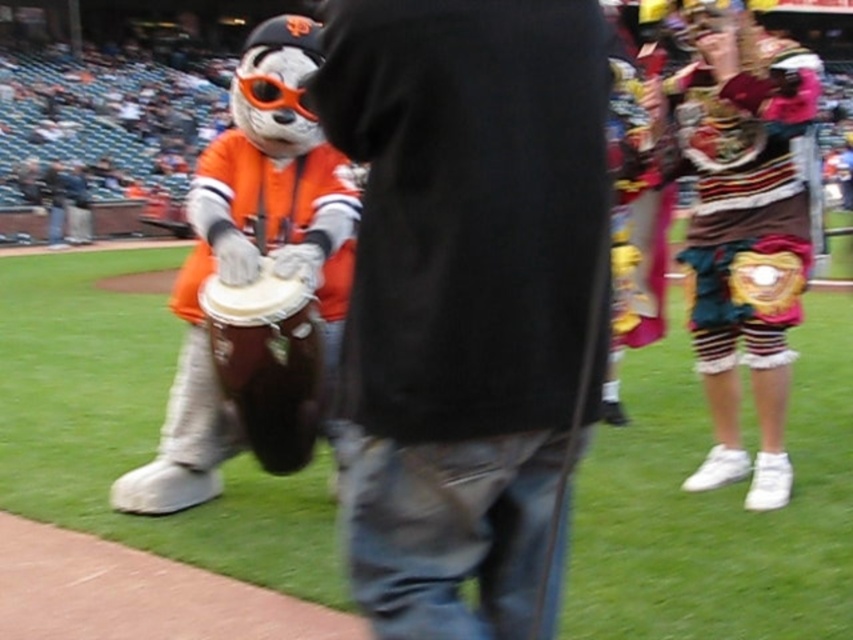
You are a photographer positioned at the front of the baseball stadium. You need to capture a photo of both the black cotton shirt at center and the orange fabric mascot at left. Based on their positions, which object should you adjust your camera focus on first to ensure both are in frame?

The orange fabric mascot at left should be focused on first since the black cotton shirt at center is to the right of it, allowing you to adjust the camera to include both in the frame by panning from left to right.

You are standing at the center of the image and want to find the striped fabric shorts at center. According to the spatial coordinates provided, in which direction should you look to locate them?

The striped fabric shorts at center is located at point coordinates with an x value of 0.353 and y value of 0.870. Since the center of the image is typically at coordinates like 0.5, the x value being less than 0.5 means it is to the left, and the y value being higher than 0.5 indicates it is above the center. Therefore, you should look to the upper left direction from the center to find the striped fabric shorts at center.

You are a photographer at the baseball stadium and want to capture both the black cotton shirt at center and the striped fabric shorts at center in a single photo. Which object should you focus on to ensure both are in frame?

The black cotton shirt at center is smaller than the striped fabric shorts at center, so you should focus on the larger object, the striped fabric shorts at center, to ensure both are in frame.